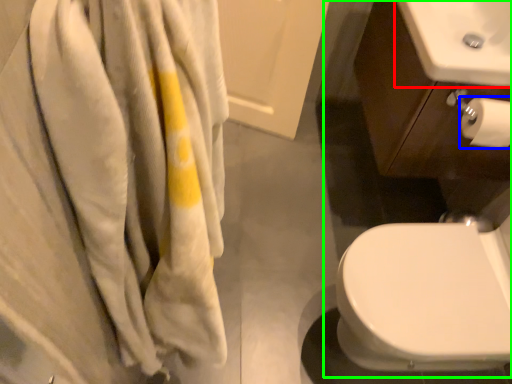
Question: Which object is the farthest from sink (highlighted by a red box)? Choose among these: toilet paper (highlighted by a blue box) or sink (highlighted by a green box).

Choices:
 (A) toilet paper
 (B) sink

Answer: (A)